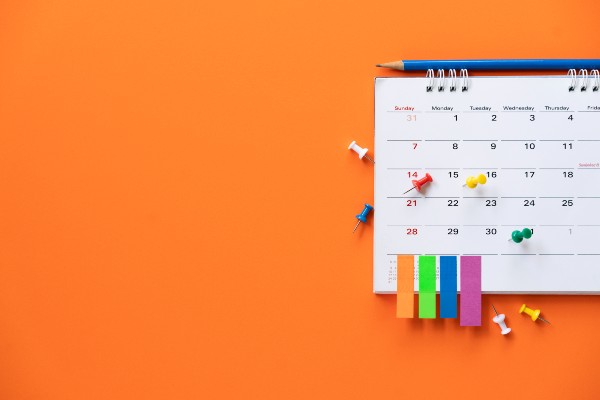
This screenshot has height=400, width=600. Find the location of `push pins`. push pins is located at coordinates (360, 217), (359, 149), (418, 186), (475, 182), (521, 237), (533, 310), (506, 324).